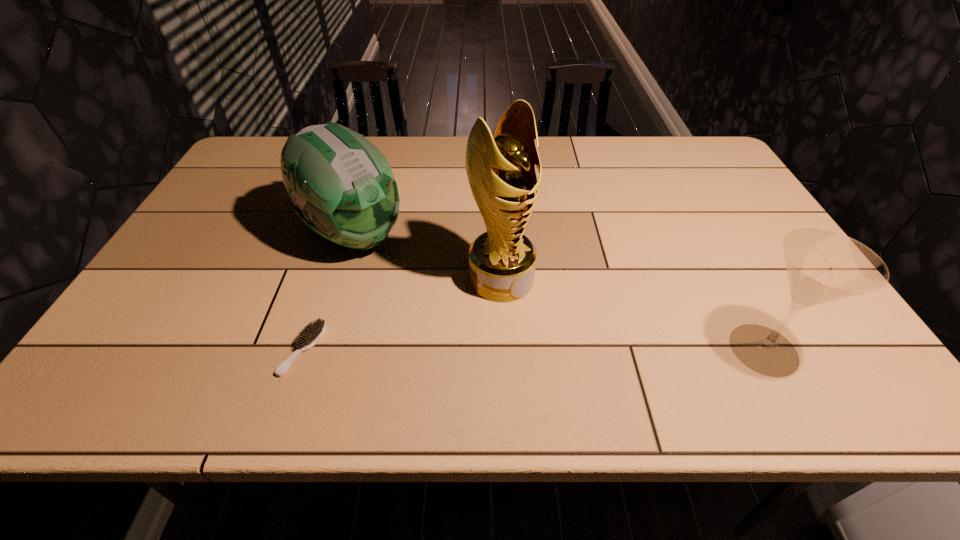
At what (x,y) coordinates should I click in order to perform the action: click on free space at the far left corner of the desktop. Please return your answer as a coordinate pair (x, y). Looking at the image, I should click on (277, 165).

The image size is (960, 540). I want to click on free space between the football helmet and the rightmost object, so click(x=559, y=292).

What are the coordinates of `vacant space in between the rightmost object and the tallest object` in the screenshot? It's located at (633, 314).

Image resolution: width=960 pixels, height=540 pixels. Find the location of `blank region between the rightmost object and the award`. blank region between the rightmost object and the award is located at coordinates (633, 314).

The width and height of the screenshot is (960, 540). What are the coordinates of `empty space that is in between the rightmost object and the scrubbing brush` in the screenshot? It's located at (534, 349).

Where is `free space between the rightmost object and the second object from right to left`? free space between the rightmost object and the second object from right to left is located at coordinates (633, 314).

You are a GUI agent. You are given a task and a screenshot of the screen. Output one action in this format:
    pyautogui.click(x=<x>, y=<y>)
    Task: Click on the unoccupied area between the scrubbing brush and the tallest object
    The image size is (960, 540).
    Given the screenshot: What is the action you would take?
    pyautogui.click(x=402, y=314)

The image size is (960, 540). Identify the location of vacant area that lies between the second object from right to left and the football helmet. (427, 256).

Where is `free space between the football helmet and the shortest object`? The width and height of the screenshot is (960, 540). free space between the football helmet and the shortest object is located at coordinates (328, 292).

Locate an element on the screen. vacant point located between the scrubbing brush and the football helmet is located at coordinates (328, 292).